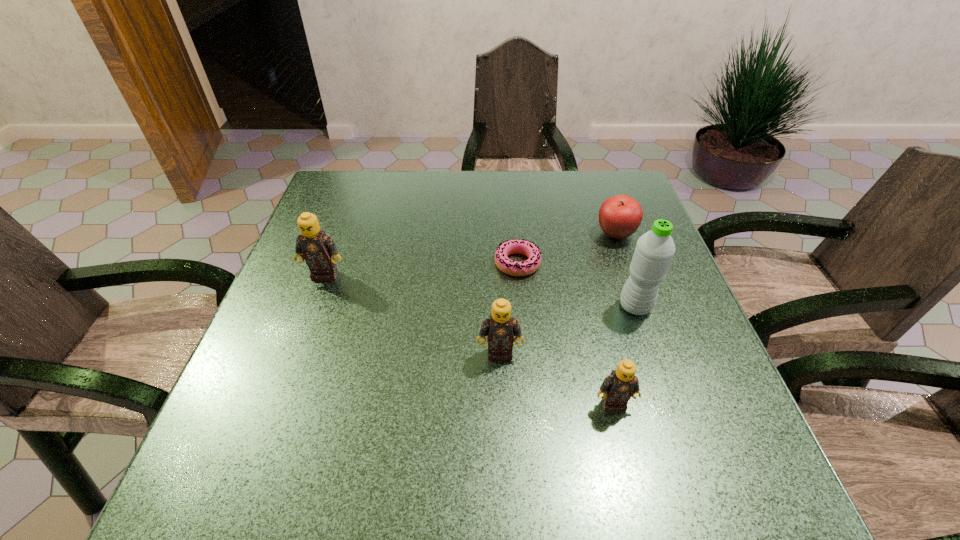
Identify the location of vacant spot for a new Lego to ensure equal spacing. (405, 310).